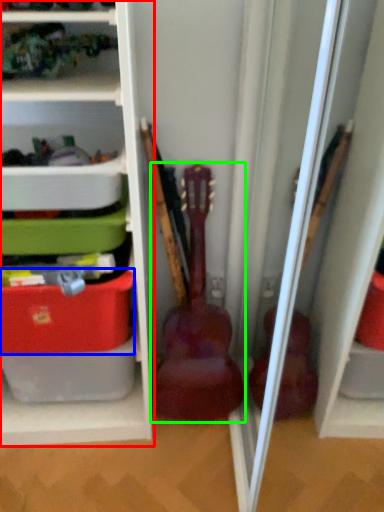
Question: Considering the real-world distances, which object is closest to shelf (highlighted by a red box)? storage box (highlighted by a blue box) or guitar (highlighted by a green box).

Choices:
 (A) storage box
 (B) guitar

Answer: (A)